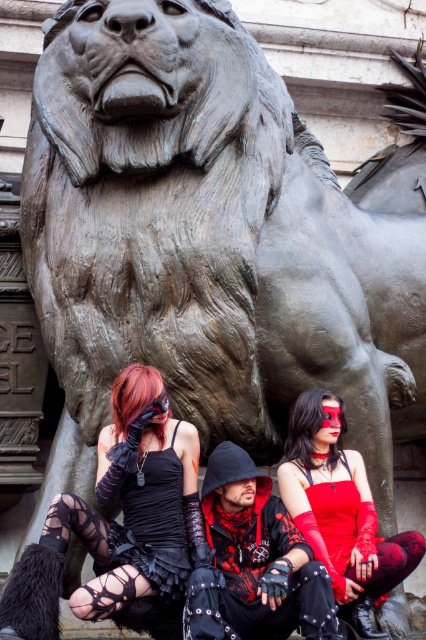
Question: Which point is closer to the camera?

Choices:
 (A) (336, 586)
 (B) (77, 499)

Answer: (B)

Question: Can you confirm if matte black dress at center is positioned above matte red dress at center?

Choices:
 (A) yes
 (B) no

Answer: (A)

Question: Can you confirm if matte black dress at center is positioned to the right of matte red dress at center?

Choices:
 (A) yes
 (B) no

Answer: (B)

Question: Does matte black dress at center have a smaller size compared to matte red dress at center?

Choices:
 (A) yes
 (B) no

Answer: (B)